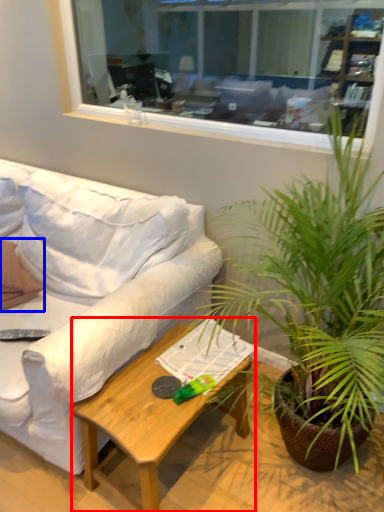
Question: Which point is further to the camera, coffee table (highlighted by a red box) or pillow (highlighted by a blue box)?

Choices:
 (A) coffee table
 (B) pillow

Answer: (B)